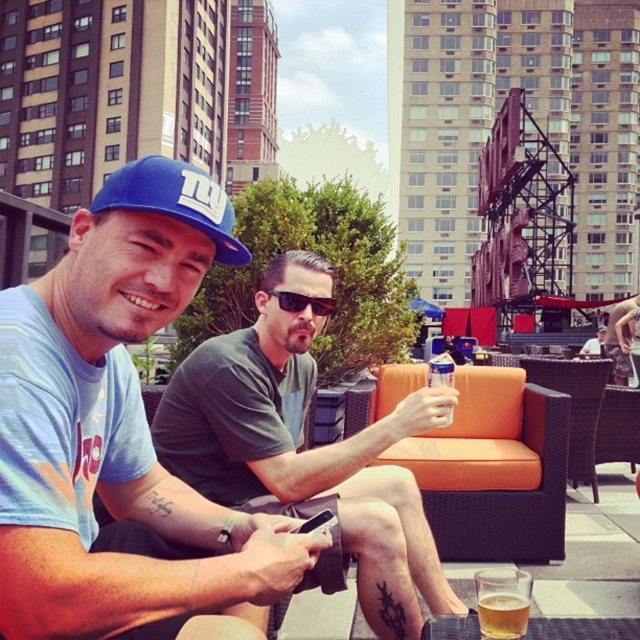
Is blue fabric cap at upper left shorter than matte gray t-shirt at center?

No.

The height and width of the screenshot is (640, 640). What do you see at coordinates (120, 433) in the screenshot?
I see `blue fabric cap at upper left` at bounding box center [120, 433].

Is point (64, 467) closer to viewer compared to point (273, 458)?

Yes.

Find the location of a particular element. blue fabric cap at upper left is located at coordinates (120, 433).

Based on the photo, who is more distant from viewer, (214,195) or (292,301)?

The point (292,301) is behind.

Is point (141, 170) less distant than point (278, 296)?

Yes, point (141, 170) is closer to viewer.

Where is `blue fabric baseball cap at upper left`? The image size is (640, 640). blue fabric baseball cap at upper left is located at coordinates tap(173, 200).

How distant is orange fabric couch at center from black plastic sunglasses at center?

orange fabric couch at center is 13.20 feet away from black plastic sunglasses at center.

Between point (477, 396) and point (300, 304), which one is positioned behind?

Point (477, 396)

This screenshot has height=640, width=640. I want to click on orange fabric couch at center, so [493, 470].